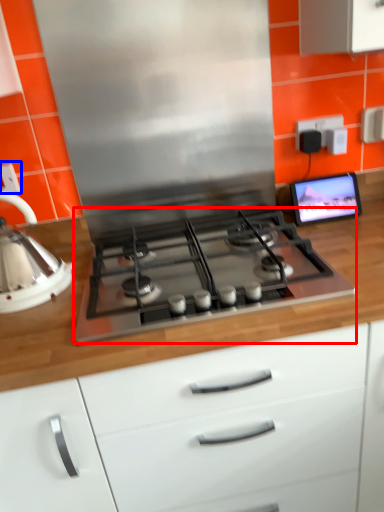
Question: Which point is further to the camera, gas stove (highlighted by a red box) or electric outlet (highlighted by a blue box)?

Choices:
 (A) gas stove
 (B) electric outlet

Answer: (B)